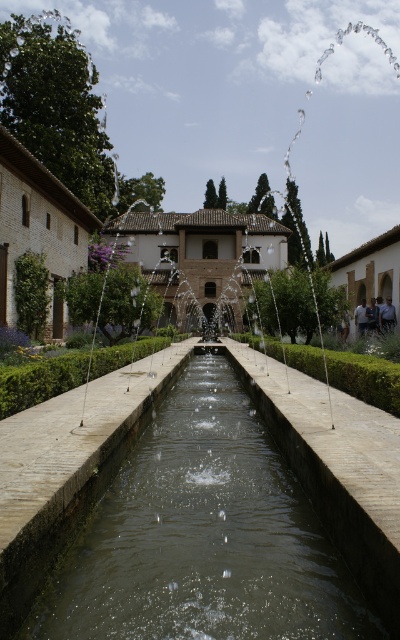
You are a tour guide leading a group along the canal. You want to ensure visitors can walk from the clear water at center to the green stone fountain at center without getting their shoes wet. The path between them is 6.17 meters. If the dry path is only 1 meter wide, can all 10 visitors walk side by side comfortably?

The path between the clear water at center and the green stone fountain at center is 1 meter wide. Since the group has 10 visitors, walking side by side would require more width than available. Therefore, they cannot all walk comfortably without overlapping.

You are a visitor at this historical site and want to take a photo that captures both the clear water at center and the green stone fountain at center. Since you want to include both in your shot, which object should you position closer to the camera to ensure both are visible in the frame?

Since the clear water at center is thinner than the green stone fountain at center, you should position the green stone fountain at center closer to the camera. This way, the wider fountain will occupy more space in the frame, allowing both objects to be captured clearly.